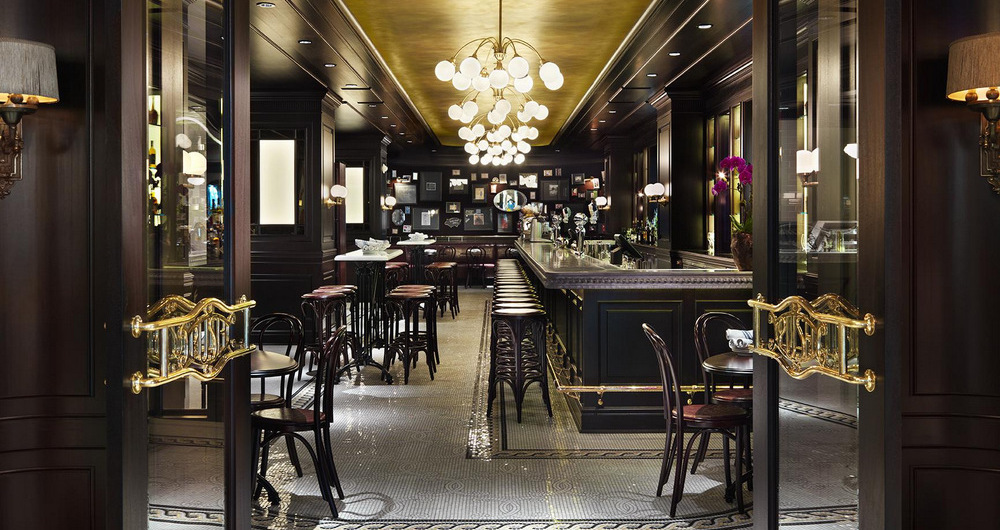
This screenshot has width=1000, height=530. In order to click on chairs in this screenshot , I will do `click(704, 412)`, `click(733, 393)`, `click(287, 418)`, `click(294, 341)`, `click(471, 259)`, `click(443, 254)`.